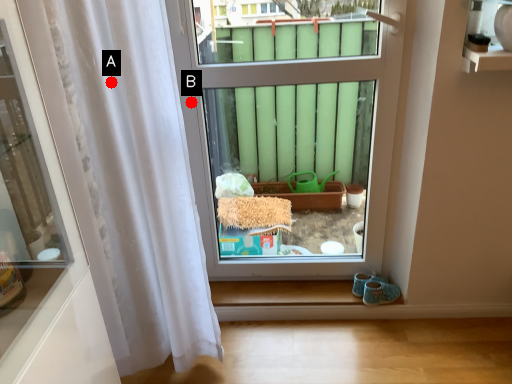
Question: Two points are circled on the image, labeled by A and B beside each circle. Which point is farther from the camera taking this photo?

Choices:
 (A) A is further
 (B) B is further

Answer: (B)